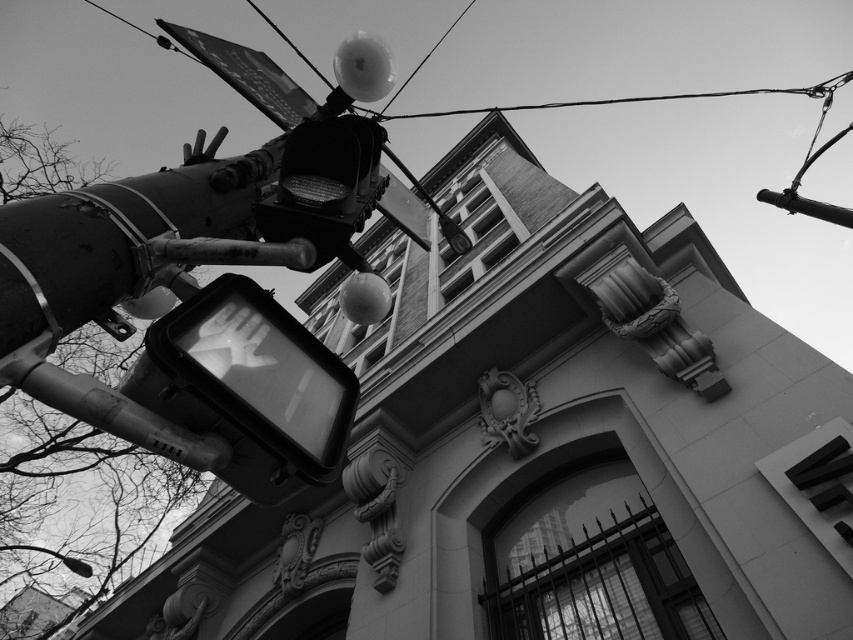
From the picture: Can you confirm if metallic traffic light at upper center is bigger than smooth metal pole at upper right?

No, metallic traffic light at upper center is not bigger than smooth metal pole at upper right.

From the picture: Who is positioned more to the left, metallic traffic light at upper center or smooth metal pole at upper right?

Positioned to the left is metallic traffic light at upper center.

Identify the location of metallic traffic light at upper center. This screenshot has height=640, width=853. (325, 188).

Who is positioned more to the right, metallic rectangular traffic light at center-left or metallic reflective street sign at upper center?

From the viewer's perspective, metallic rectangular traffic light at center-left appears more on the right side.

Between point (219, 401) and point (271, 68), which one is positioned in front?

Point (219, 401) is more forward.

What are the coordinates of `metallic rectangular traffic light at center-left` in the screenshot? It's located at (248, 387).

Where is `metallic rectangular traffic light at center-left`? metallic rectangular traffic light at center-left is located at coordinates (248, 387).

Consider the image. Can you confirm if metallic reflective street sign at upper center is shorter than smooth metal pole at upper right?

Correct, metallic reflective street sign at upper center is not as tall as smooth metal pole at upper right.

Consider the image. Is metallic reflective street sign at upper center to the left of smooth metal pole at upper right from the viewer's perspective?

Yes, metallic reflective street sign at upper center is to the left of smooth metal pole at upper right.

What do you see at coordinates (247, 74) in the screenshot? I see `metallic reflective street sign at upper center` at bounding box center [247, 74].

Image resolution: width=853 pixels, height=640 pixels. I want to click on metallic reflective street sign at upper center, so click(247, 74).